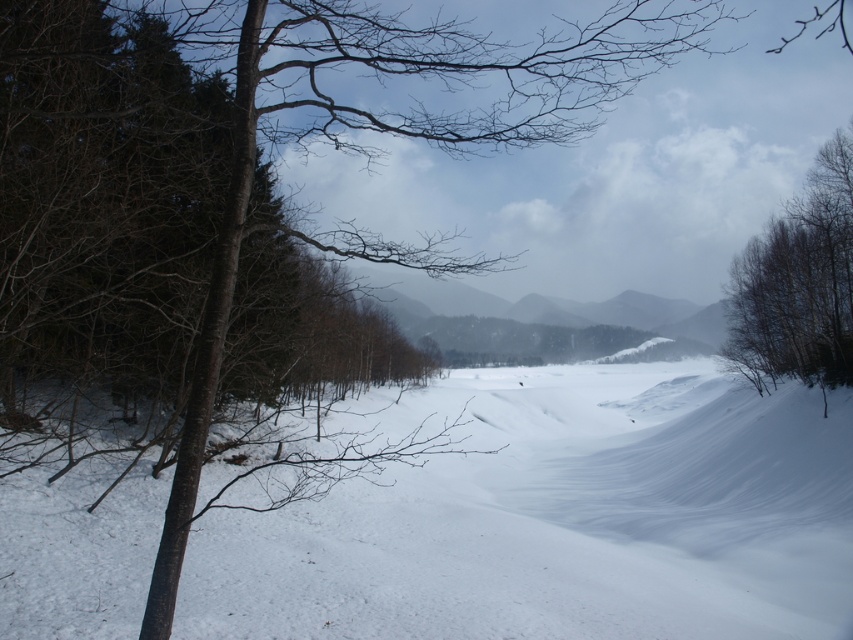
You are an explorer trying to navigate through the snowy landscape. You see the brown textured tree at right and the gray matte mountain at center. Which object is located to the east if the mountain is facing west?

The brown textured tree at right is positioned on the right side of the gray matte mountain at center. Since the mountain is facing west, the right side would correspond to the south direction. Therefore, the brown textured tree at right is located to the south, not the east. The gray matte mountain at center faces west, so its right side is south, meaning the tree is south of the mountain.

You are an observer standing in the winter landscape. You notice the white snow at center and the brown textured tree at right. Which object is closer to you?

The white snow at center is closer to you because it is in front of the brown textured tree at right.